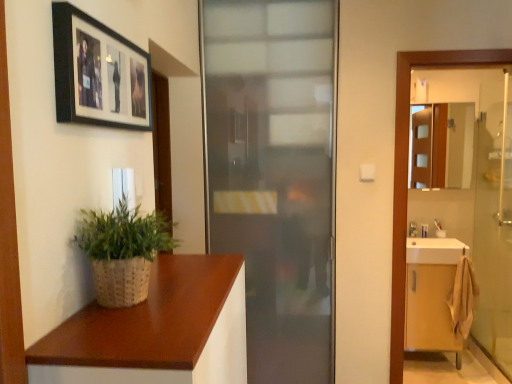
Where is `vacant region below woven natural plant at lower left (from a real-world perspective)`? The height and width of the screenshot is (384, 512). vacant region below woven natural plant at lower left (from a real-world perspective) is located at coordinates (133, 306).